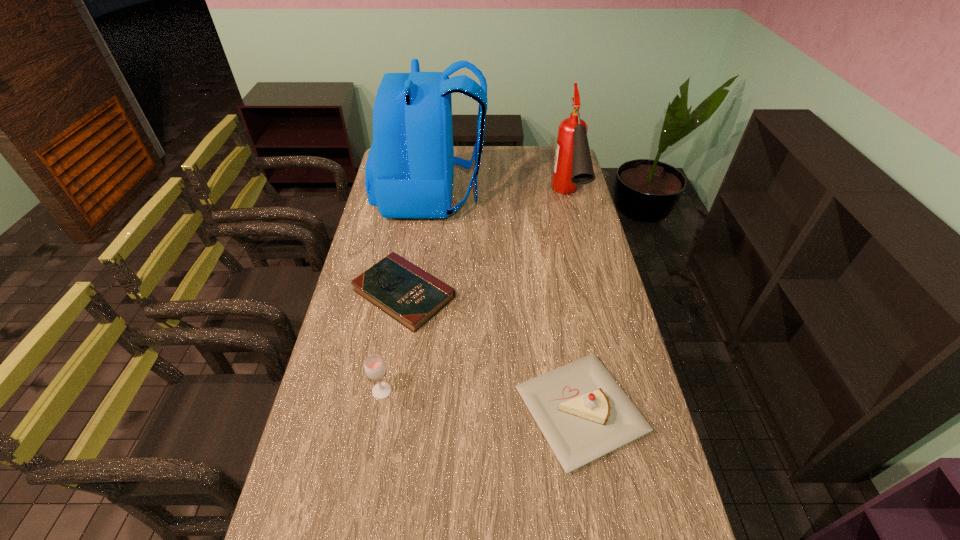
Locate an element on the screen. The height and width of the screenshot is (540, 960). backpack is located at coordinates (409, 171).

The height and width of the screenshot is (540, 960). I want to click on fire extinguisher, so click(572, 165).

Locate an element on the screen. The height and width of the screenshot is (540, 960). wineglass is located at coordinates (375, 368).

Where is `the fourth tallest object`? The height and width of the screenshot is (540, 960). the fourth tallest object is located at coordinates (583, 413).

You are a GUI agent. You are given a task and a screenshot of the screen. Output one action in this format:
    pyautogui.click(x=<x>, y=<y>)
    Task: Click on the shortest object
    The width and height of the screenshot is (960, 540).
    Given the screenshot: What is the action you would take?
    pyautogui.click(x=411, y=296)

Find the location of a particular element. the third nearest object is located at coordinates (411, 296).

Identify the location of free location located 0.380m on the back of the tallest object. The width and height of the screenshot is (960, 540). (575, 196).

You are a GUI agent. You are given a task and a screenshot of the screen. Output one action in this format:
    pyautogui.click(x=<x>, y=<y>)
    Task: Click on the free location located 0.290m at the nozzle of the fire extinguisher
    This screenshot has width=960, height=540.
    Given the screenshot: What is the action you would take?
    pyautogui.click(x=588, y=286)

Identify the location of vacant space located on the right of the wineglass. This screenshot has width=960, height=540. (413, 392).

Where is `vacant space located on the left of the cake`? This screenshot has height=540, width=960. vacant space located on the left of the cake is located at coordinates (457, 411).